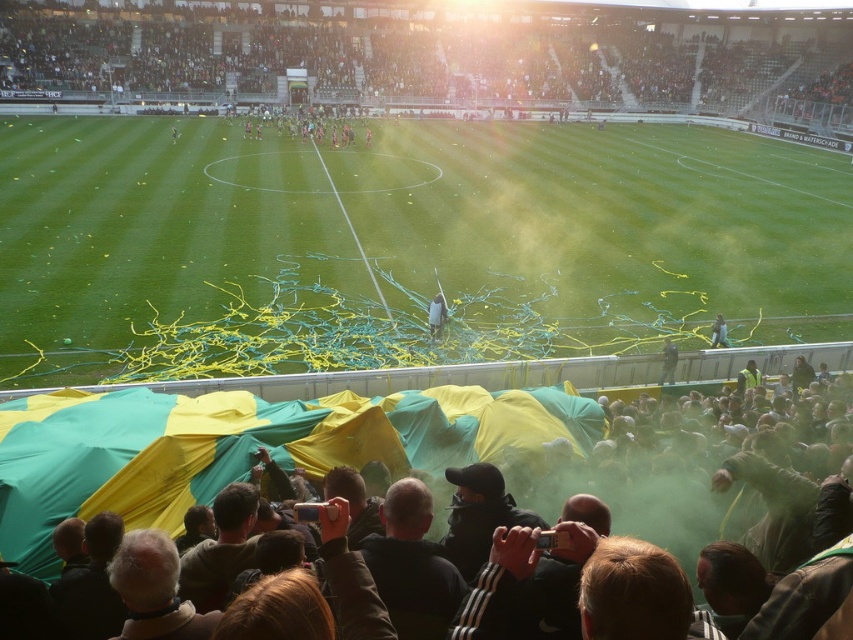
Question: Is green fabric crowd at upper center positioned behind yellow-green fabric at lower center?

Choices:
 (A) no
 (B) yes

Answer: (B)

Question: Is yellow-green fabric at lower center positioned in front of dark blue jacket at center?

Choices:
 (A) no
 (B) yes

Answer: (B)

Question: Based on their relative distances, which object is nearer to the dark blue jacket at center?

Choices:
 (A) dark gray jacket at center
 (B) white matte jacket at center

Answer: (A)

Question: In this image, where is green grass at center located relative to yellow-green fabric at lower center?

Choices:
 (A) below
 (B) above

Answer: (B)

Question: Which object appears farthest from the camera in this image?

Choices:
 (A) green fabric crowd at upper center
 (B) dark gray jacket at center
 (C) dark blue jacket at center

Answer: (A)

Question: Which object appears farthest from the camera in this image?

Choices:
 (A) white matte jacket at center
 (B) green grass at center

Answer: (A)